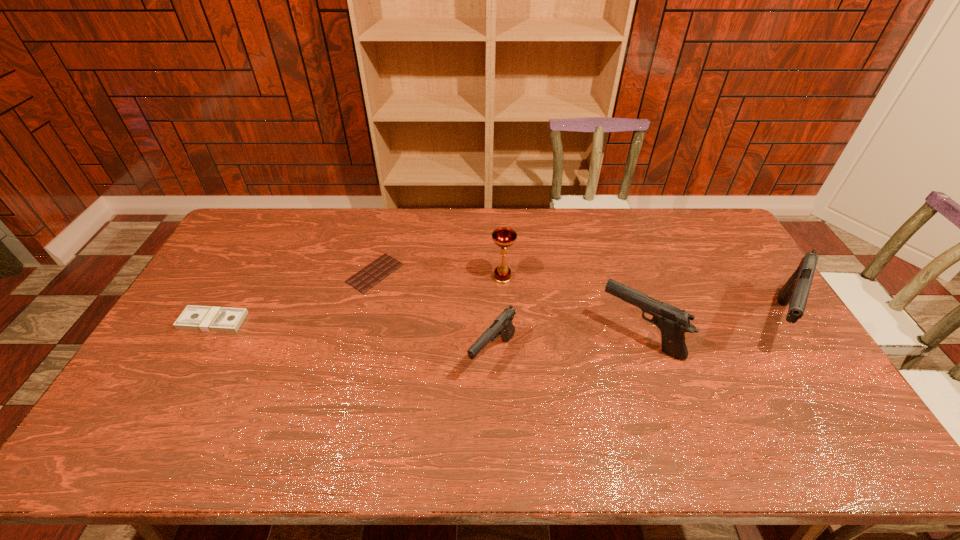
Where is `chalice`? chalice is located at coordinates (504, 237).

Where is `vacant point located at the muzzle of the third shortest object`? The width and height of the screenshot is (960, 540). vacant point located at the muzzle of the third shortest object is located at coordinates (494, 402).

Identify the location of vacant position located 0.200m at the muzzle of the fifth object from left to right. The image size is (960, 540). (532, 338).

Identify the location of free space located at the muzzle of the fifth object from left to right. (573, 338).

You are a GUI agent. You are given a task and a screenshot of the screen. Output one action in this format:
    pyautogui.click(x=<x>, y=<y>)
    Task: Click on the free region located at the muzzle of the fifth object from left to right
    The width and height of the screenshot is (960, 540).
    Given the screenshot: What is the action you would take?
    pyautogui.click(x=468, y=338)

Where is `vacant space located 0.140m at the muzzle of the rightmost gun`? The height and width of the screenshot is (540, 960). vacant space located 0.140m at the muzzle of the rightmost gun is located at coordinates (828, 403).

Locate an element on the screen. The width and height of the screenshot is (960, 540). vacant space located 0.150m on the front of the second shortest object is located at coordinates (181, 376).

At what (x,y) coordinates should I click in order to perform the action: click on vacant space located on the right of the shortest object. Please return your answer as a coordinate pair (x, y). This screenshot has width=960, height=540. Looking at the image, I should click on pos(435,273).

Find the location of `vacant region located on the left of the chalice`. vacant region located on the left of the chalice is located at coordinates (445, 278).

Image resolution: width=960 pixels, height=540 pixels. Identify the location of object at the left edge. (200, 318).